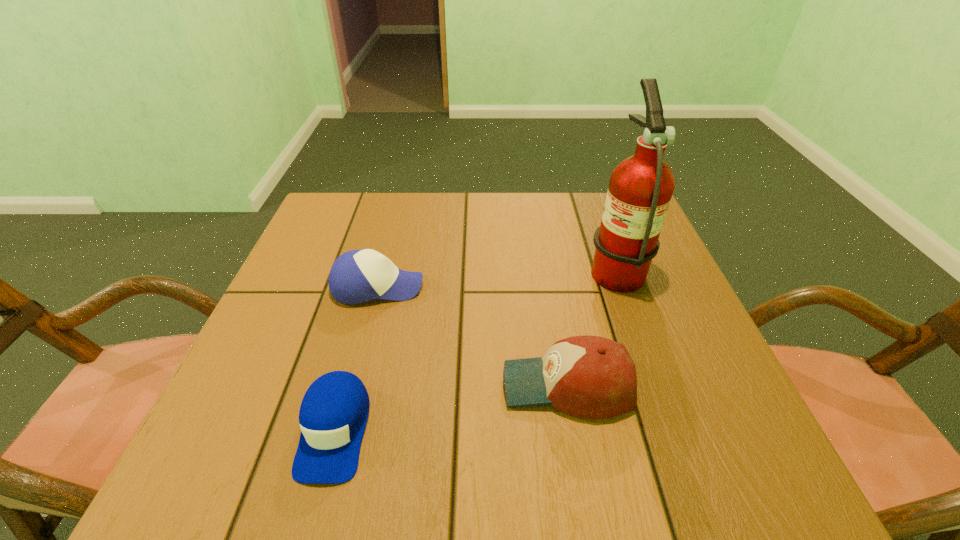
I want to click on blank area at the far left corner, so click(x=345, y=201).

The width and height of the screenshot is (960, 540). In order to click on free location at the near right corner in this screenshot , I will do `click(677, 476)`.

Locate an element on the screen. blank region between the third shortest object and the tallest object is located at coordinates (591, 326).

Locate an element on the screen. The width and height of the screenshot is (960, 540). free spot between the shortest object and the tallest baseball cap is located at coordinates (451, 408).

Where is `free space between the fire extinguisher and the third shortest object`? The image size is (960, 540). free space between the fire extinguisher and the third shortest object is located at coordinates (591, 326).

You are a GUI agent. You are given a task and a screenshot of the screen. Output one action in this format:
    pyautogui.click(x=<x>, y=<y>)
    Task: Click on the vacant space in between the farthest baseball cap and the tallest object
    This screenshot has width=960, height=540.
    Given the screenshot: What is the action you would take?
    pyautogui.click(x=496, y=277)

I want to click on vacant area that lies between the second tallest object and the shortest object, so click(451, 408).

Where is `free area in between the farthest baseball cap and the shortest baseball cap`? free area in between the farthest baseball cap and the shortest baseball cap is located at coordinates (356, 359).

Identify the location of free area in between the farthest baseball cap and the tallest object. The width and height of the screenshot is (960, 540). (496, 277).

Find the location of a particular element. This screenshot has height=540, width=960. free spot between the farthest baseball cap and the rightmost baseball cap is located at coordinates [x=472, y=336].